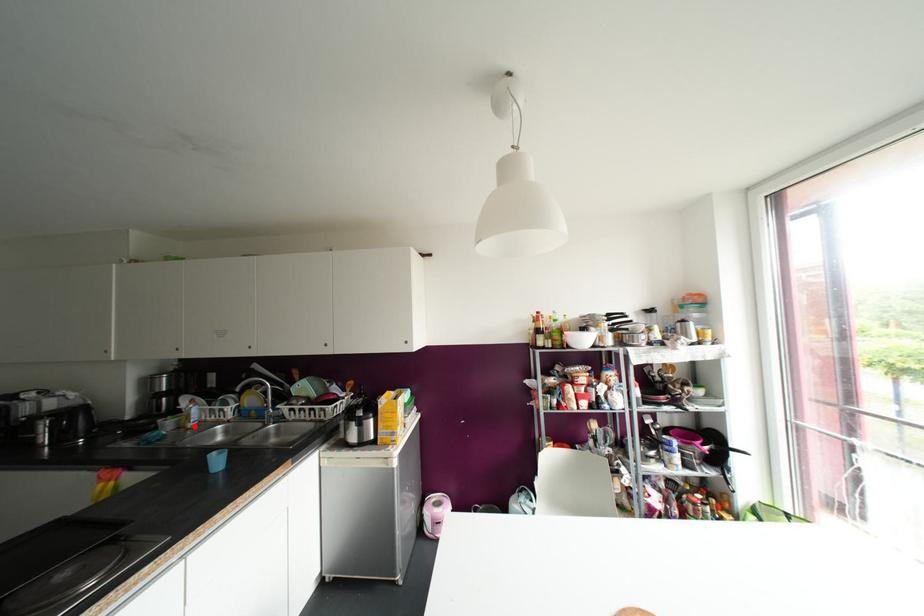
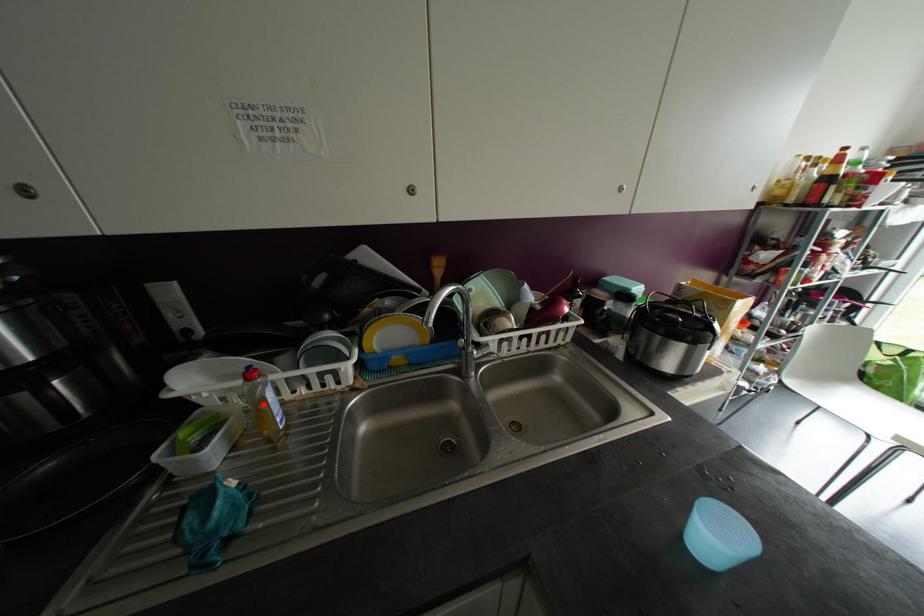
I am providing you with two images of the same scene from different viewpoints. A red point is marked on the first image and another point is marked on the second image. Is the marked point in image1 the same physical position as the marked point in image2?

No